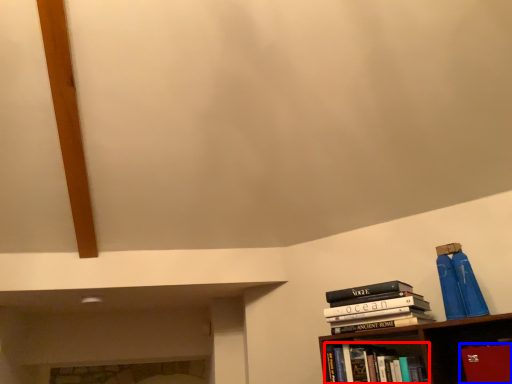
Question: Which point is closer to the camera, book (highlighted by a red box) or paperback book (highlighted by a blue box)?

Choices:
 (A) book
 (B) paperback book

Answer: (B)